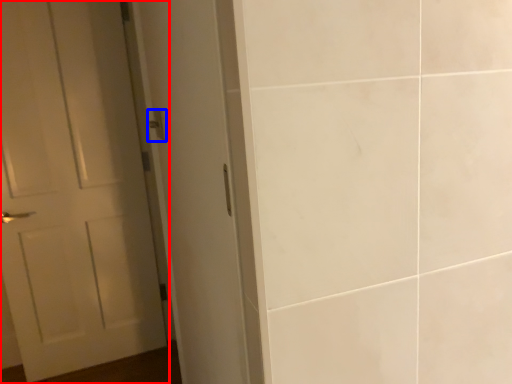
Question: Which of the following is the closest to the observer, door (highlighted by a red box) or door handle (highlighted by a blue box)?

Choices:
 (A) door
 (B) door handle

Answer: (B)